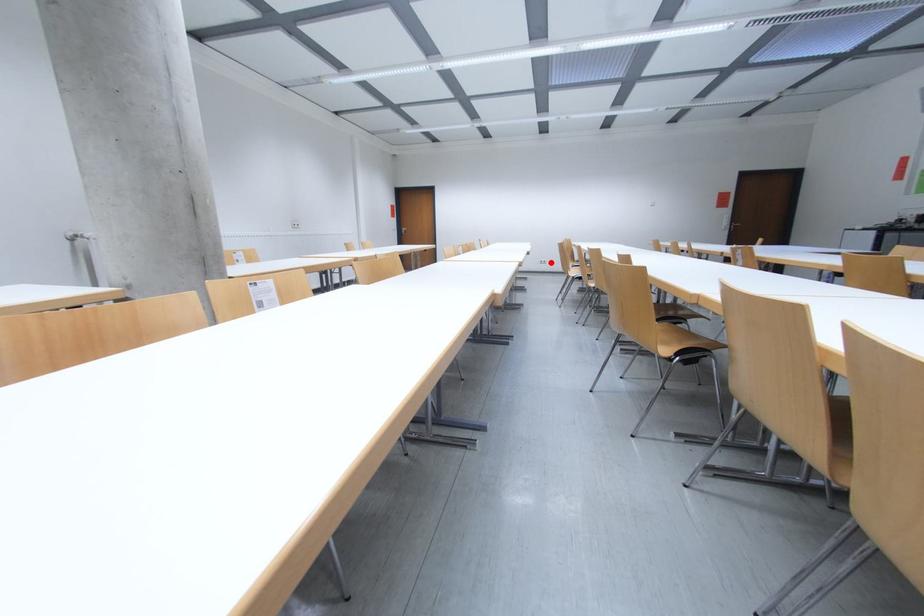
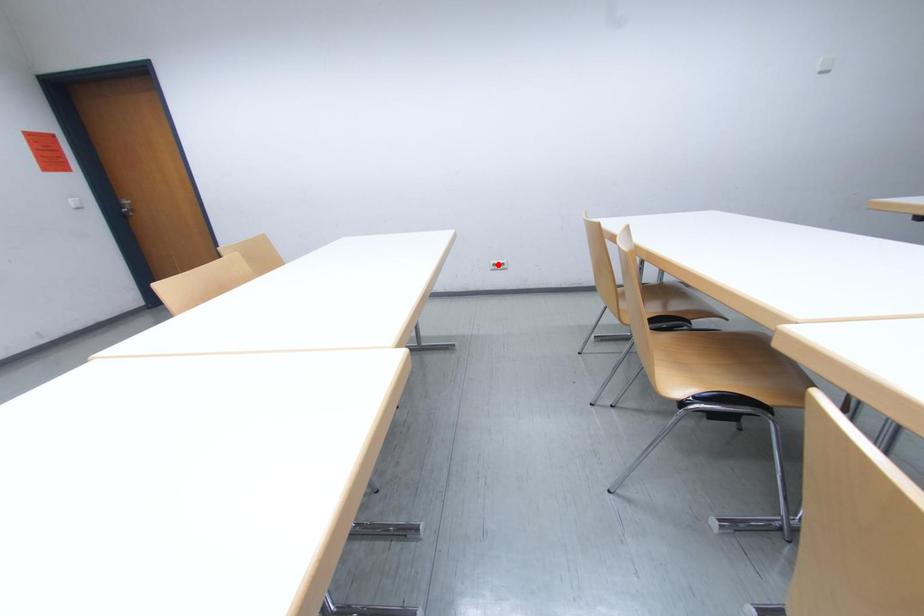
I am providing you with two images of the same scene from different viewpoints. A red point is marked on the first image and another point is marked on the second image. Is the red point in image1 aligned with the point shown in image2?

No